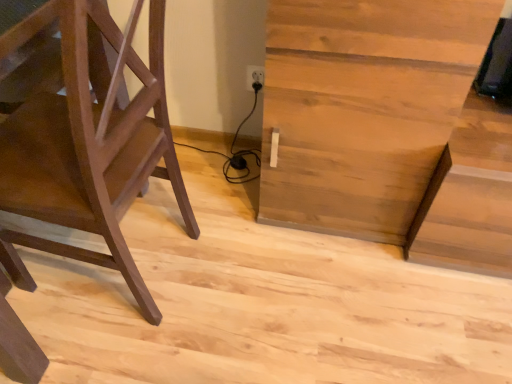
Question: Is matte brown ladder at left wider or thinner than light brown wood table at center?

Choices:
 (A) thin
 (B) wide

Answer: (B)

Question: Do you think matte brown ladder at left is within light brown wood table at center, or outside of it?

Choices:
 (A) outside
 (B) inside

Answer: (A)

Question: Is point (110, 16) closer or farther from the camera than point (290, 175)?

Choices:
 (A) closer
 (B) farther

Answer: (A)

Question: Based on their sizes in the image, would you say light brown wood table at center is bigger or smaller than matte brown ladder at left?

Choices:
 (A) small
 (B) big

Answer: (B)

Question: From a real-world perspective, is light brown wood table at center positioned above or below matte brown ladder at left?

Choices:
 (A) above
 (B) below

Answer: (B)

Question: In terms of width, does light brown wood table at center look wider or thinner when compared to matte brown ladder at left?

Choices:
 (A) wide
 (B) thin

Answer: (B)

Question: From the image's perspective, relative to matte brown ladder at left, is light brown wood table at center above or below?

Choices:
 (A) below
 (B) above

Answer: (B)